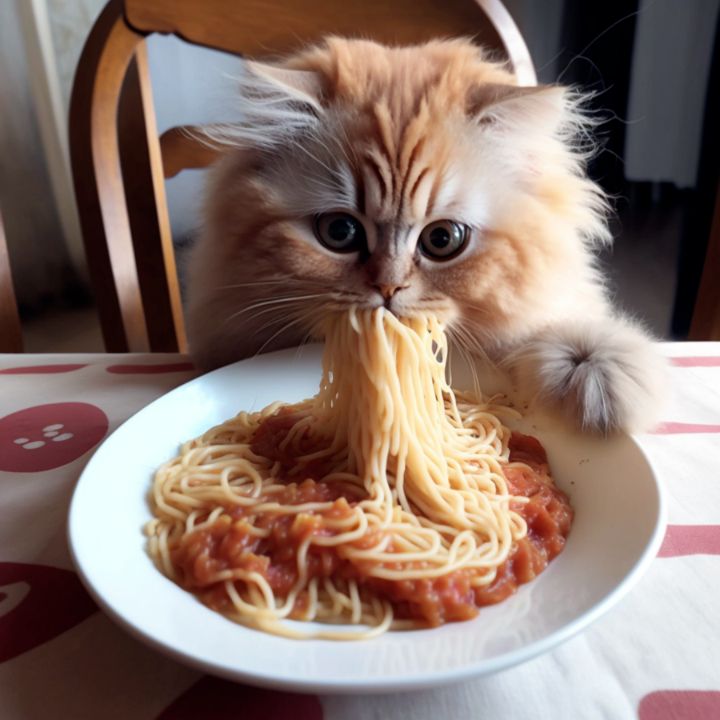
Find the location of a particular element. This screenshot has width=720, height=720. white shallow bowl is located at coordinates (121, 508).